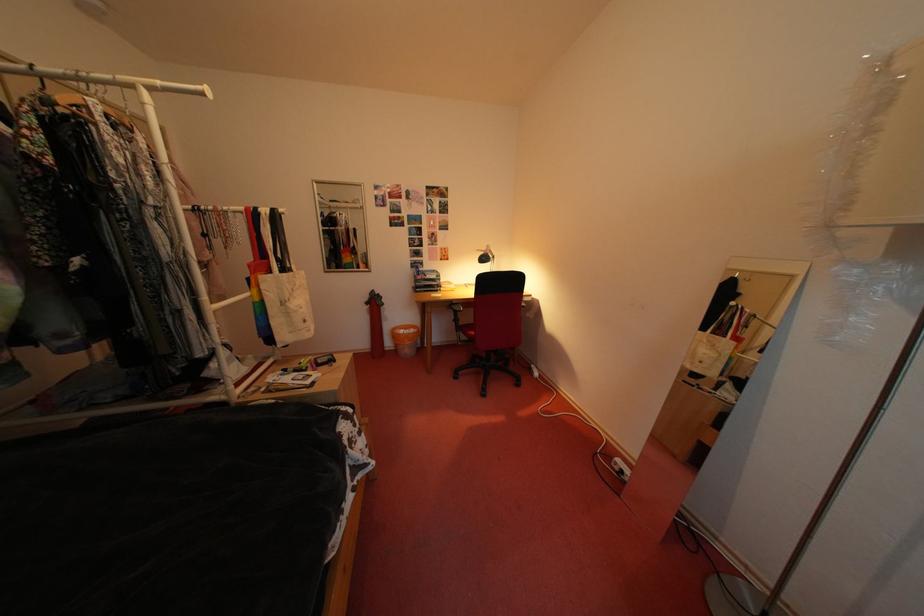
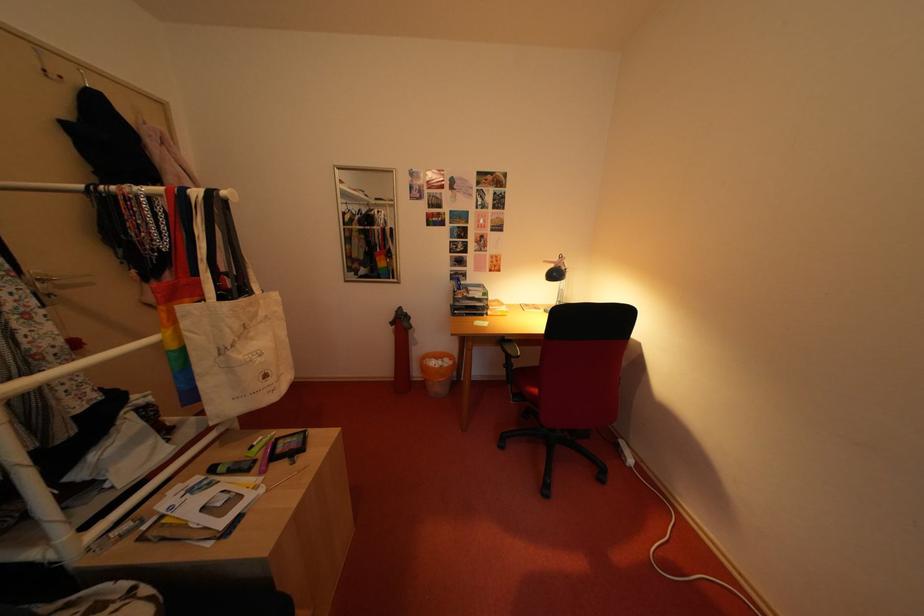
Find the pixel in the second image that matches point (314, 326) in the first image.

(275, 381)